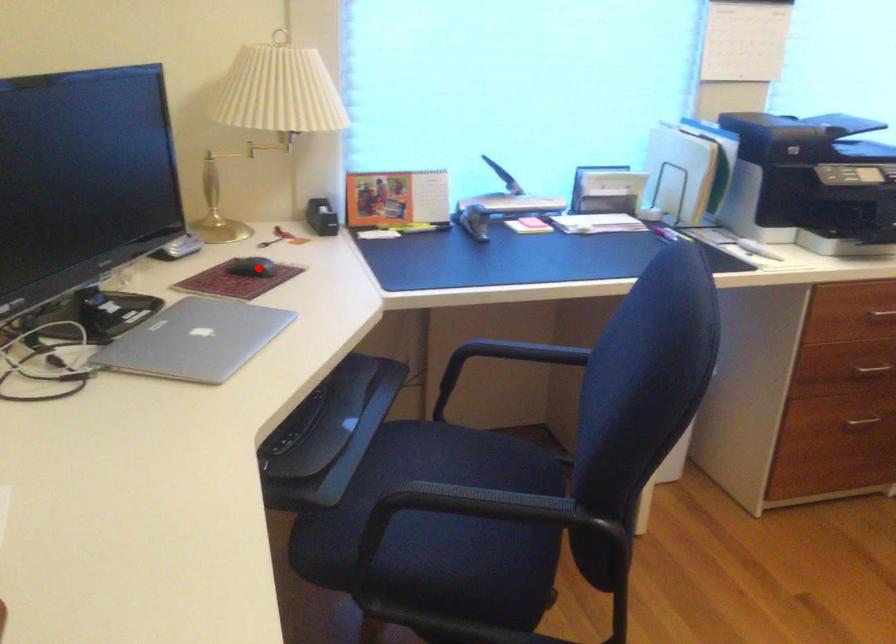
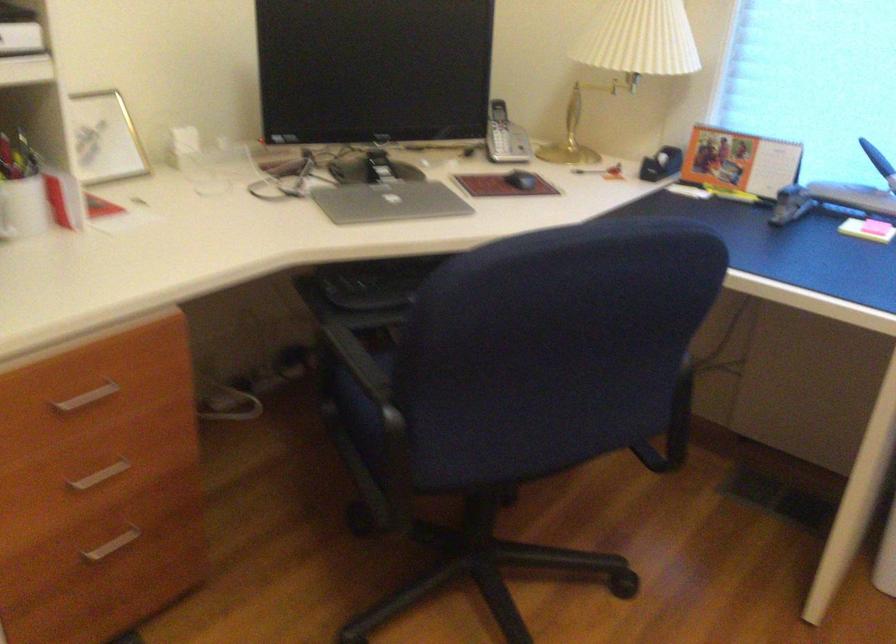
Question: A red point is marked in image1. In image2, is the corresponding 3D point closer to the camera or farther? Reply with the corresponding letter.

Choices:
 (A) The corresponding 3D point is closer.
 (B) The corresponding 3D point is farther.

Answer: (B)